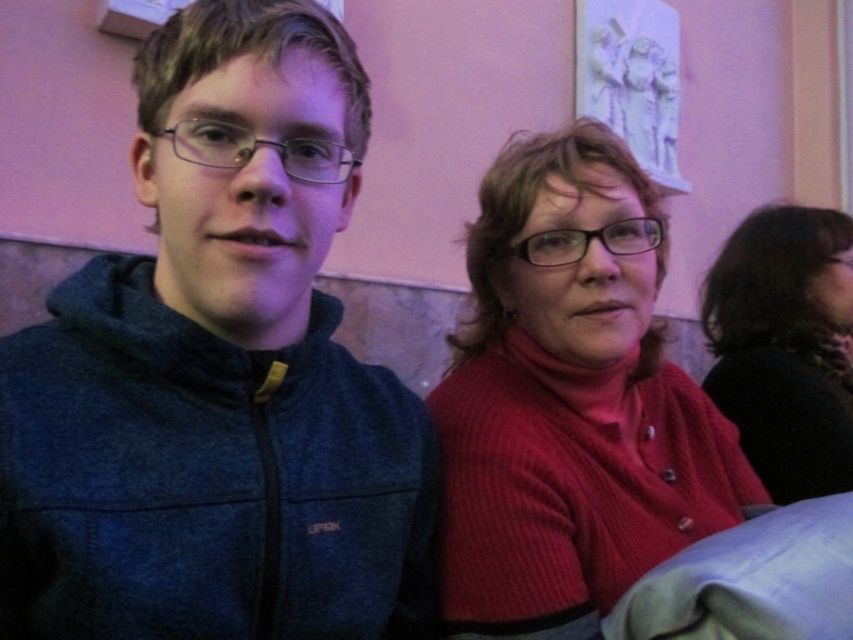
Consider the image. You are a photographer trying to adjust your camera focus to the dark blue fleece jacket at left. The camera has a focus point at coordinate point (219, 374). Is this focus point correctly positioned over the dark blue fleece jacket at left?

Yes, the focus point at coordinate point (219, 374) is correctly positioned over the dark blue fleece jacket at left as described in the objects description.

Based on the photo, you are trying to decide which item to take from the scene. You need something on the left side of the image. Which item should you choose between the dark blue fleece jacket at left and the black sweater at right?

The dark blue fleece jacket at left is to the left of the black sweater at right, so you should choose the dark blue fleece jacket at left.

You are standing in the room where the two people are sitting. You want to move from the point at coordinates point (93, 422) to the point at coordinates point (769, 337). Is the destination point closer to the camera or further away?

The point at coordinates point (93, 422) is in front of the point at coordinates point (769, 337), so the destination point is further away from the camera.